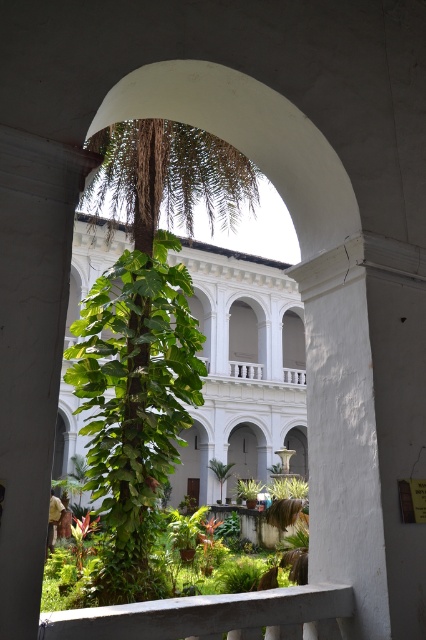
Question: Does white smooth pillar at right have a smaller size compared to white concrete balustrade at lower center?

Choices:
 (A) yes
 (B) no

Answer: (B)

Question: Which object is the closest to the white smooth pillar at right?

Choices:
 (A) white concrete balustrade at lower center
 (B) green leafy plant at center

Answer: (A)

Question: Does white smooth pillar at right have a larger size compared to white concrete balustrade at lower center?

Choices:
 (A) yes
 (B) no

Answer: (A)

Question: Which object is the closest to the white concrete balustrade at lower center?

Choices:
 (A) white smooth pillar at right
 (B) green leafy plant at center

Answer: (A)

Question: Can you confirm if white smooth pillar at right is positioned to the right of white concrete balustrade at lower center?

Choices:
 (A) yes
 (B) no

Answer: (A)

Question: Which of these objects is positioned closest to the white smooth pillar at right?

Choices:
 (A) white concrete balustrade at lower center
 (B) green leafy plant at center

Answer: (A)